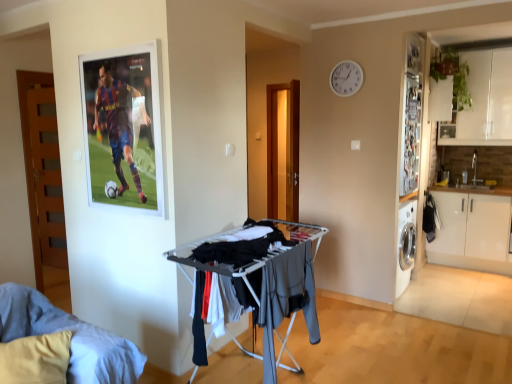
Question: Does white matte cabinet at right lie behind dark gray fabric drying rack at center?

Choices:
 (A) yes
 (B) no

Answer: (A)

Question: Can you confirm if white matte cabinet at right is thinner than dark gray fabric drying rack at center?

Choices:
 (A) no
 (B) yes

Answer: (A)

Question: Is white matte cabinet at right shorter than dark gray fabric drying rack at center?

Choices:
 (A) yes
 (B) no

Answer: (B)

Question: Is white matte cabinet at right oriented towards dark gray fabric drying rack at center?

Choices:
 (A) no
 (B) yes

Answer: (B)

Question: From the image's perspective, would you say white matte cabinet at right is positioned over dark gray fabric drying rack at center?

Choices:
 (A) yes
 (B) no

Answer: (B)

Question: Which is correct: wooden door at left is inside white matte cabinet at right, or outside of it?

Choices:
 (A) inside
 (B) outside

Answer: (B)

Question: Looking at the image, does wooden door at left seem bigger or smaller compared to white matte cabinet at right?

Choices:
 (A) small
 (B) big

Answer: (A)

Question: From a real-world perspective, is wooden door at left above or below white matte cabinet at right?

Choices:
 (A) below
 (B) above

Answer: (B)

Question: Considering the positions of point (40, 248) and point (459, 233), is point (40, 248) closer or farther from the camera than point (459, 233)?

Choices:
 (A) closer
 (B) farther

Answer: (A)

Question: Based on their positions, is dark gray fabric drying rack at center located to the left or right of white plastic clock at upper center?

Choices:
 (A) left
 (B) right

Answer: (A)

Question: Is dark gray fabric drying rack at center taller or shorter than white plastic clock at upper center?

Choices:
 (A) short
 (B) tall

Answer: (A)

Question: In terms of size, does dark gray fabric drying rack at center appear bigger or smaller than white plastic clock at upper center?

Choices:
 (A) big
 (B) small

Answer: (A)

Question: Which is correct: dark gray fabric drying rack at center is inside white plastic clock at upper center, or outside of it?

Choices:
 (A) inside
 (B) outside

Answer: (B)

Question: From a real-world perspective, is wooden door at left above or below white plastic clock at upper center?

Choices:
 (A) above
 (B) below

Answer: (B)

Question: Visually, is wooden door at left positioned to the left or to the right of white plastic clock at upper center?

Choices:
 (A) left
 (B) right

Answer: (A)